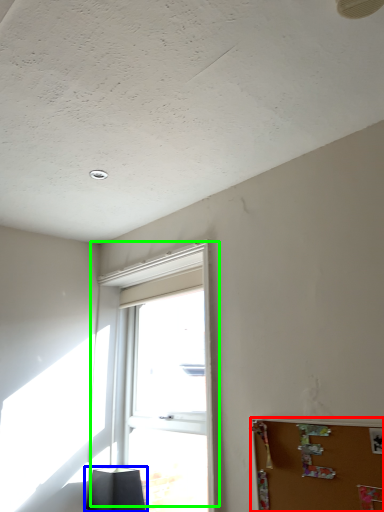
Question: Which is nearer to the bulletin board (highlighted by a red box)? lamp (highlighted by a blue box) or window (highlighted by a green box).

Choices:
 (A) lamp
 (B) window

Answer: (B)